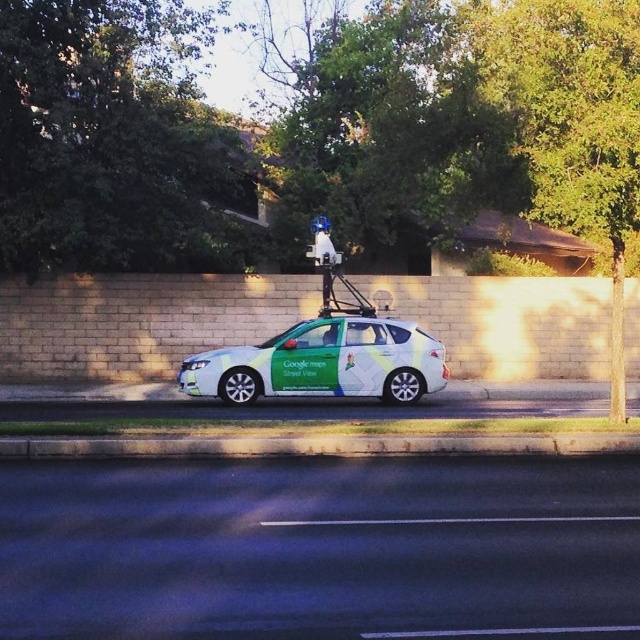
Can you confirm if green glossy car at center is positioned below concrete at lower center?

Actually, green glossy car at center is above concrete at lower center.

Who is higher up, green glossy car at center or concrete at lower center?

green glossy car at center is higher up.

The width and height of the screenshot is (640, 640). What do you see at coordinates (323, 364) in the screenshot?
I see `green glossy car at center` at bounding box center [323, 364].

The height and width of the screenshot is (640, 640). What are the coordinates of `green glossy car at center` in the screenshot? It's located at (323, 364).